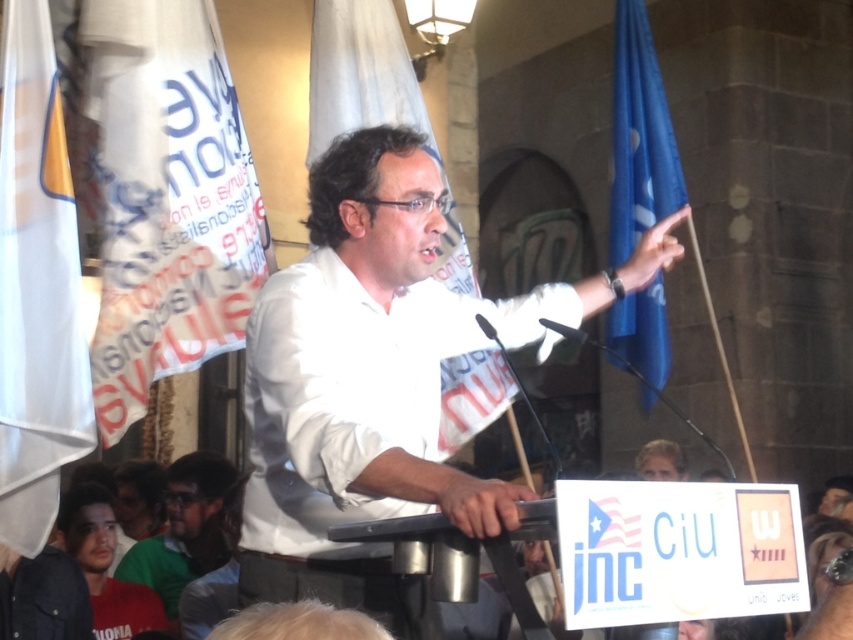
Which is below, white fabric banner at upper left or green matte shirt at lower left?

green matte shirt at lower left is lower down.

Does white fabric banner at upper left lie in front of green matte shirt at lower left?

Yes.

Does point (201, 156) come closer to viewer compared to point (165, 605)?

Yes, point (201, 156) is in front of point (165, 605).

Locate an element on the screen. white fabric banner at upper left is located at coordinates (165, 198).

Is white matte shirt at center shorter than white fabric flag at center?

Yes.

Between point (476, 486) and point (479, 369), which one is positioned in front?

Point (476, 486)

Which is in front, point (428, 420) or point (485, 388)?

Point (428, 420) is more forward.

Locate an element on the screen. The height and width of the screenshot is (640, 853). white matte shirt at center is located at coordinates (376, 378).

Between white fabric banner at upper left and blue fabric flag at right, which one appears on the right side from the viewer's perspective?

blue fabric flag at right is more to the right.

Does point (167, 173) come farther from viewer compared to point (625, 317)?

No, (167, 173) is closer to viewer.

This screenshot has height=640, width=853. In order to click on white fabric banner at upper left in this screenshot , I will do `click(165, 198)`.